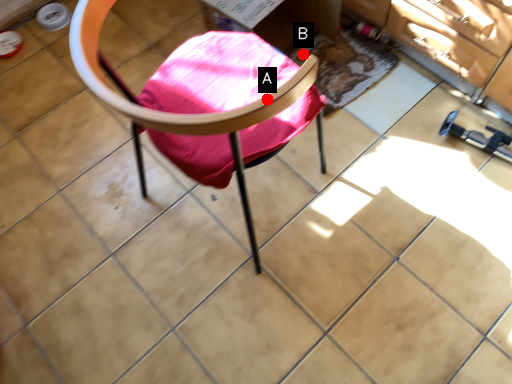
Question: Two points are circled on the image, labeled by A and B beside each circle. Which of the following is the closest to the observer?

Choices:
 (A) A is closer
 (B) B is closer

Answer: (A)